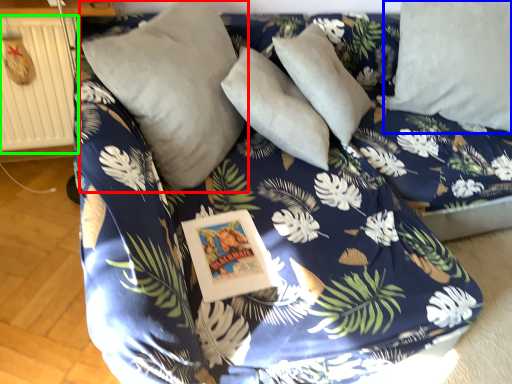
Question: Based on their relative distances, which object is nearer to pillow (highlighted by a red box)? Choose from pillow (highlighted by a blue box) and radiator (highlighted by a green box).

Choices:
 (A) pillow
 (B) radiator

Answer: (B)